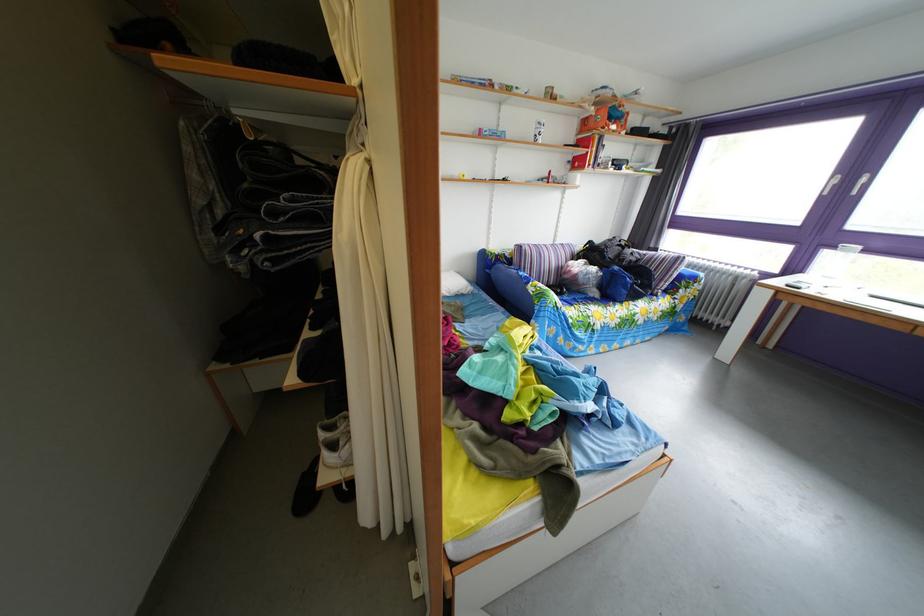
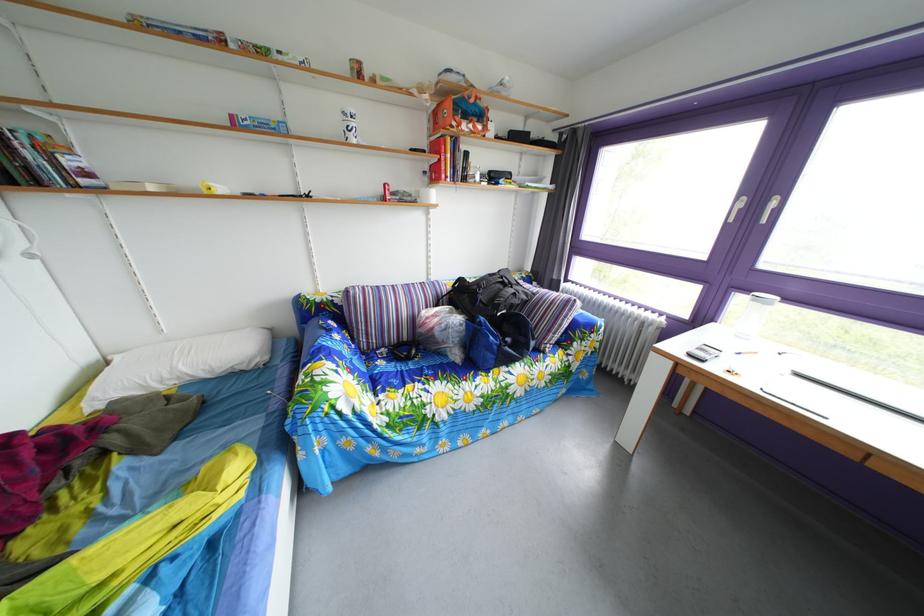
What movement of the cameraman would produce the second image?

The movement direction of the cameraman is right, forward.